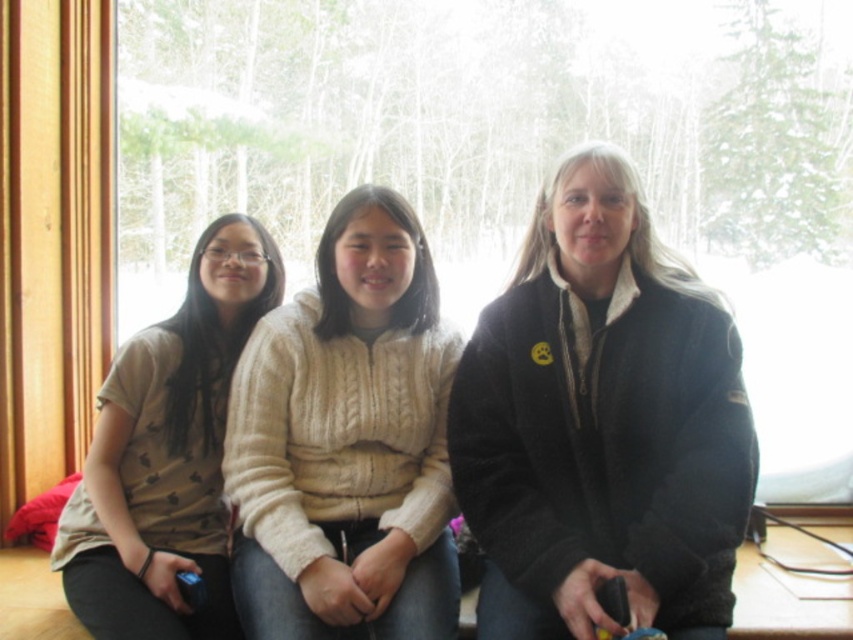
You are standing in front of the window and want to touch both the creamy knit sweater at center and the matte beige sweater at left. Which one can you reach first without moving your position?

The creamy knit sweater at center is closer to the viewer than the matte beige sweater at left, so you can reach it first without moving your position.

You are trying to decide which jacket to wear today. You see the black fuzzy jacket at center and the matte beige sweater at left in the image. Which one is positioned higher up in the image?

The black fuzzy jacket at center is positioned higher up in the image than the matte beige sweater at left.